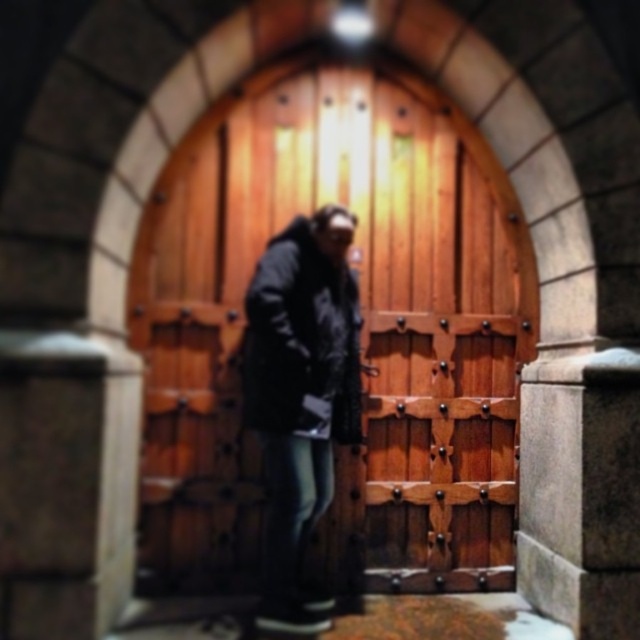
Question: Does wooden at center lie in front of dark gray fabric jacket at center?

Choices:
 (A) yes
 (B) no

Answer: (B)

Question: Which point is closer to the camera taking this photo?

Choices:
 (A) (419, 145)
 (B) (268, 561)

Answer: (B)

Question: Which of the following is the closest to the observer?

Choices:
 (A) (412, 563)
 (B) (316, 324)

Answer: (B)

Question: Does wooden at center have a larger size compared to dark gray fabric jacket at center?

Choices:
 (A) yes
 (B) no

Answer: (A)

Question: Which point is farther to the camera?

Choices:
 (A) dark gray fabric jacket at center
 (B) wooden at center

Answer: (B)

Question: Does wooden at center have a larger size compared to dark gray fabric jacket at center?

Choices:
 (A) yes
 (B) no

Answer: (A)